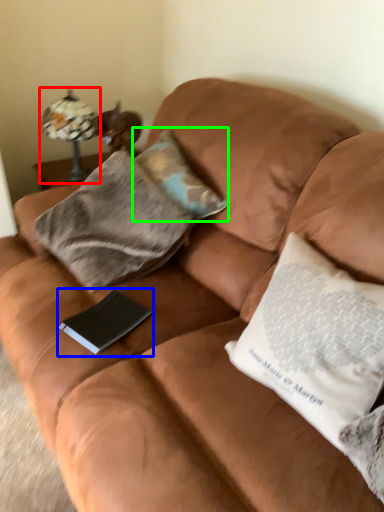
Question: Which object is positioned closest to lamp (highlighted by a red box)? Select from paperback book (highlighted by a blue box) and pillow (highlighted by a green box).

Choices:
 (A) paperback book
 (B) pillow

Answer: (B)